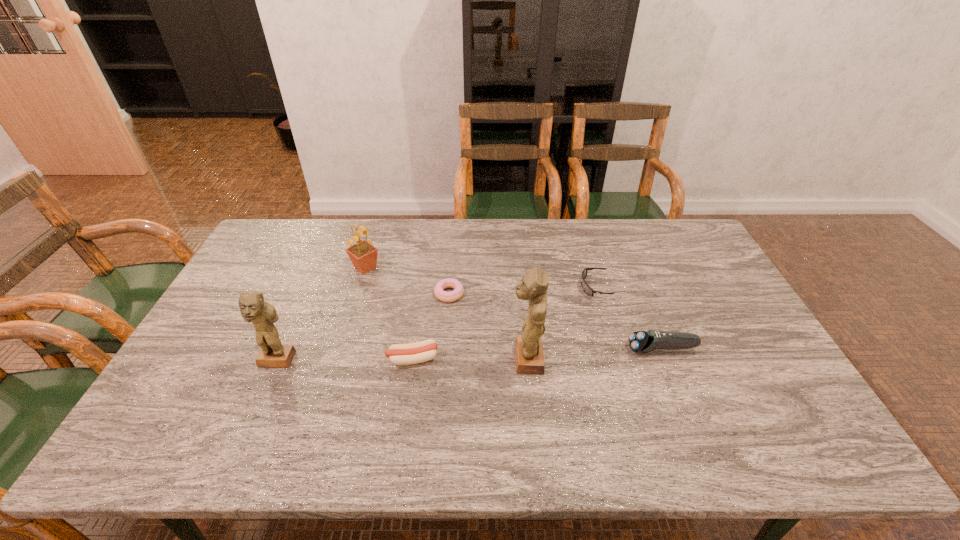
What are the coordinates of `the leftmost object` in the screenshot? It's located at (253, 308).

You are a GUI agent. You are given a task and a screenshot of the screen. Output one action in this format:
    pyautogui.click(x=<x>, y=<y>)
    Task: Click on the shorter figurine
    This screenshot has width=960, height=540.
    Given the screenshot: What is the action you would take?
    pyautogui.click(x=253, y=308)

Locate an element on the screen. This screenshot has width=960, height=540. the right figurine is located at coordinates (533, 286).

I want to click on the third object from right to left, so click(533, 286).

Where is `the fifth shortest object`? The image size is (960, 540). the fifth shortest object is located at coordinates (363, 255).

This screenshot has height=540, width=960. Find the location of `sunflower`. sunflower is located at coordinates (363, 255).

Identify the location of goggles. This screenshot has width=960, height=540. (588, 290).

Identify the location of the shortest object. [x=456, y=294].

Identify the location of electric shaver. Image resolution: width=960 pixels, height=540 pixels. (640, 341).

At what (x,y) coordinates should I click in order to perform the action: click on sausage. Please return your answer as a coordinate pair (x, y). The width and height of the screenshot is (960, 540). Looking at the image, I should click on (399, 354).